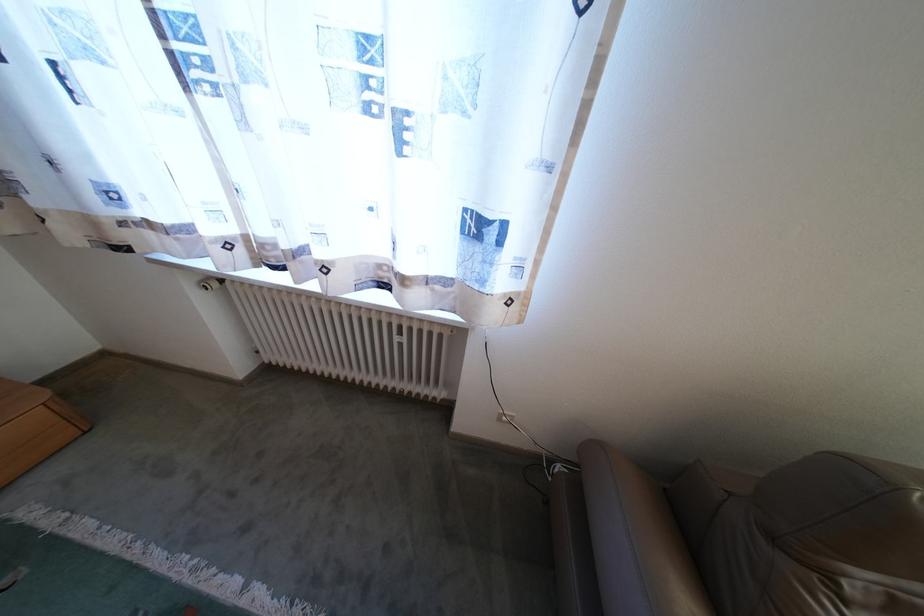
The height and width of the screenshot is (616, 924). Describe the element at coordinates (505, 416) in the screenshot. I see `a white power plug` at that location.